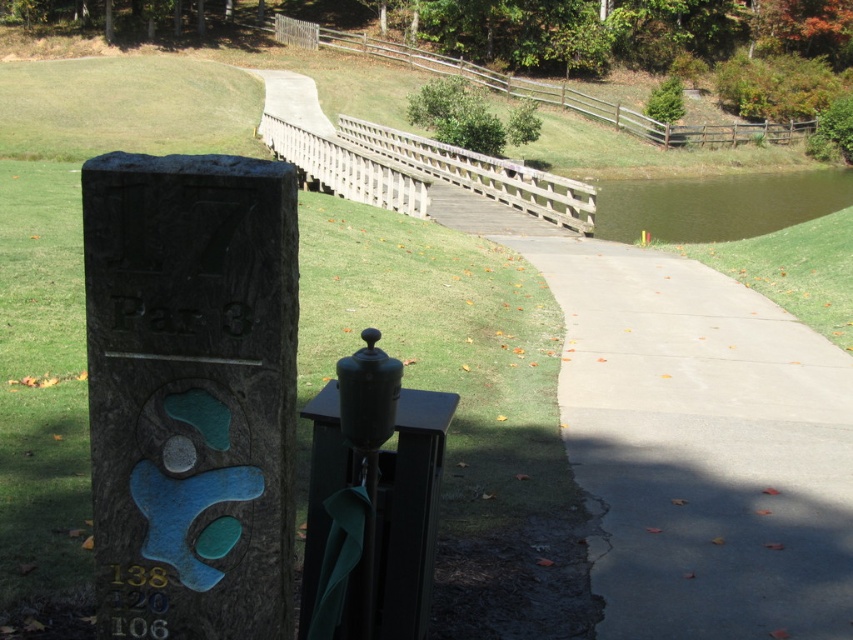
You are standing at the camera position and want to touch the bronze textured sign at left. Is it possible to reach it without moving your feet?

The bronze textured sign at left is 7.54 feet away from the camera position. Since the average human arm length is about 2.5 feet, you cannot reach it without moving your feet.

You are standing at the golf course and see the stone marker with the engraved text. There is a point marked at coordinates [190,394]. Which object does this point belong to?

The point marked at coordinates [190,394] is on the bronze textured sign at left.